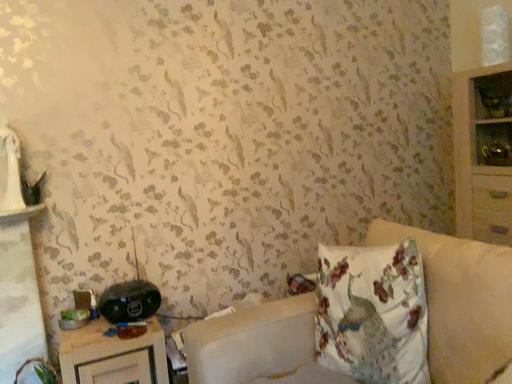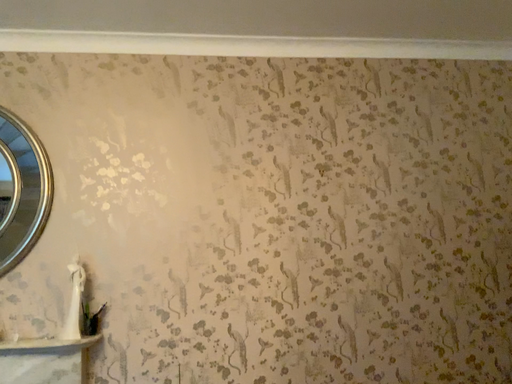
Question: How did the camera likely rotate when shooting the video?

Choices:
 (A) rotated right
 (B) rotated left

Answer: (B)